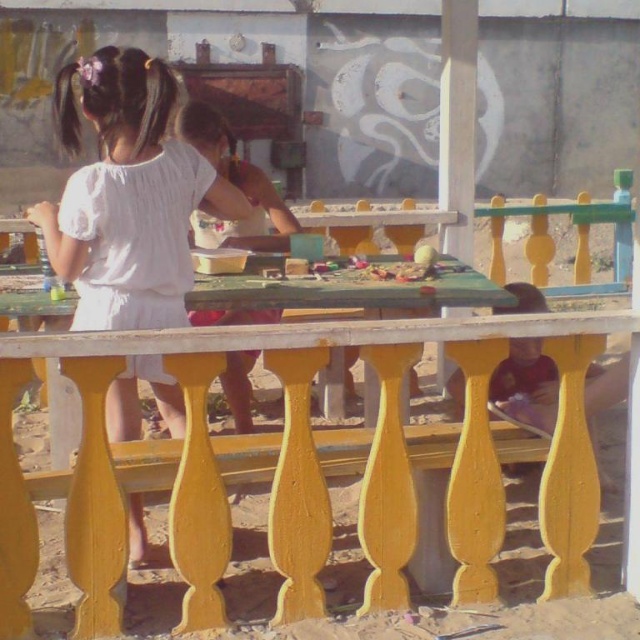
Can you confirm if white cotton dress at center is wider than yellow painted wood table at center?

Incorrect, white cotton dress at center's width does not surpass yellow painted wood table at center's.

Can you confirm if white cotton dress at center is bigger than yellow painted wood table at center?

Incorrect, white cotton dress at center is not larger than yellow painted wood table at center.

The width and height of the screenshot is (640, 640). I want to click on white cotton dress at center, so click(x=128, y=195).

Where is `white cotton dress at center`? This screenshot has height=640, width=640. white cotton dress at center is located at coordinates (128, 195).